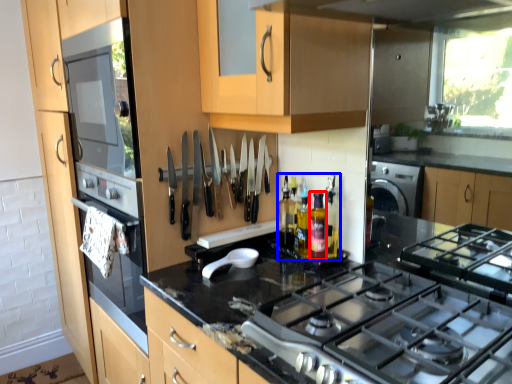
Question: Which of the following is the farthest to the observer, bottle (highlighted by a red box) or bottle (highlighted by a blue box)?

Choices:
 (A) bottle
 (B) bottle

Answer: (B)